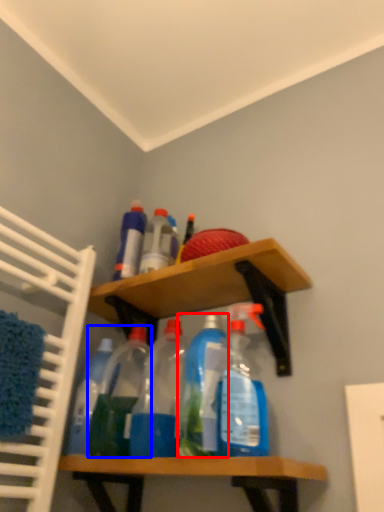
Question: Which object appears closest to the camera in this image, bottle (highlighted by a red box) or bottle (highlighted by a blue box)?

Choices:
 (A) bottle
 (B) bottle

Answer: (A)